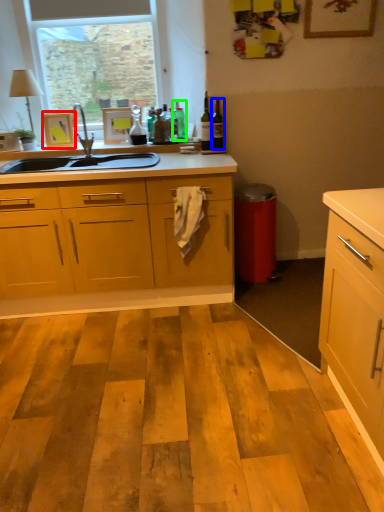
Question: Which object is the farthest from picture frame (highlighted by a red box)? Choose among these: bottle (highlighted by a blue box) or bottle (highlighted by a green box).

Choices:
 (A) bottle
 (B) bottle

Answer: (A)